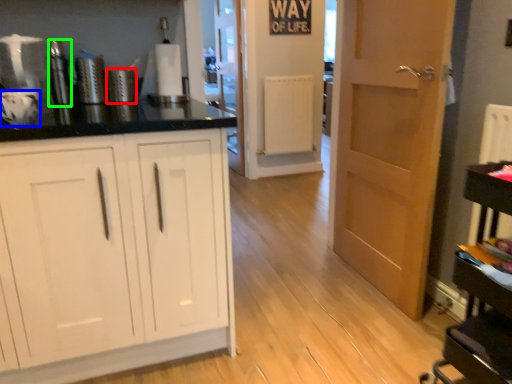
Question: Based on their relative distances, which object is farther from appliance (highlighted by a red box)? Choose from appliance (highlighted by a blue box) and appliance (highlighted by a green box).

Choices:
 (A) appliance
 (B) appliance

Answer: (A)